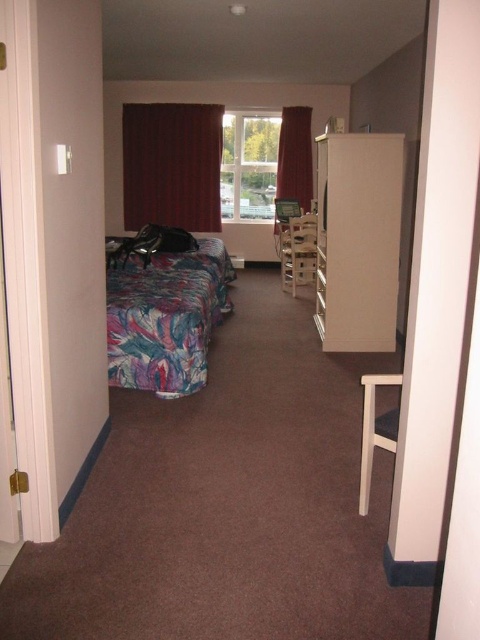
Locate an element on the screen. white glossy dresser at center is located at coordinates (358, 240).

Does white glossy dresser at center come behind velvet red curtain at center?

That is False.

This screenshot has height=640, width=480. I want to click on white glossy dresser at center, so click(x=358, y=240).

Does velvet burgundy curtain at center have a smaller size compared to white plastic chair at center?

Actually, velvet burgundy curtain at center might be larger than white plastic chair at center.

Which is behind, point (177, 200) or point (392, 372)?

Positioned behind is point (177, 200).

Is point (192, 177) positioned in front of point (385, 419)?

That is False.

At what (x,y) coordinates should I click in order to perform the action: click on velvet burgundy curtain at center. Please return your answer as a coordinate pair (x, y). The width and height of the screenshot is (480, 640). Looking at the image, I should click on (171, 164).

Is point (370, 240) less distant than point (195, 365)?

No, it is behind (195, 365).

Between white glossy dresser at center and printed fabric bed at left, which one appears on the right side from the viewer's perspective?

white glossy dresser at center is more to the right.

Between point (324, 332) and point (205, 275), which one is positioned in front?

Positioned in front is point (324, 332).

This screenshot has width=480, height=640. I want to click on white glossy dresser at center, so click(x=358, y=240).